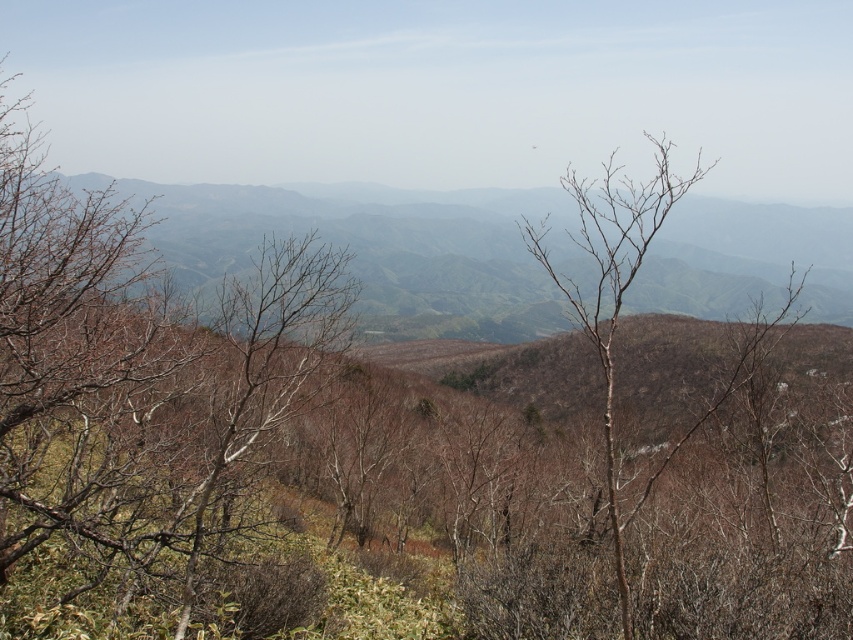
Question: Is brown leafless branches at left smaller than green matte mountain at center?

Choices:
 (A) no
 (B) yes

Answer: (B)

Question: Which object appears farthest from the camera in this image?

Choices:
 (A) brown leafless branches at left
 (B) green matte mountain at center
 (C) bare branches at center

Answer: (B)

Question: Does brown leafless branches at left have a larger size compared to bare branches at center?

Choices:
 (A) no
 (B) yes

Answer: (A)

Question: Does brown leafless branches at left come in front of green matte mountain at center?

Choices:
 (A) yes
 (B) no

Answer: (A)

Question: Based on their relative distances, which object is nearer to the green matte mountain at center?

Choices:
 (A) bare branches at center
 (B) brown leafless branches at left

Answer: (A)

Question: Which object appears closest to the camera in this image?

Choices:
 (A) brown leafless branches at left
 (B) green matte mountain at center
 (C) bare branches at center

Answer: (C)